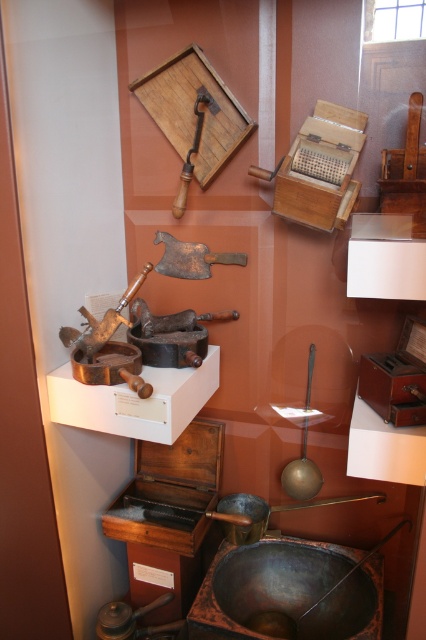
Question: Observing the image, what is the correct spatial positioning of brass/bronze axe at center in reference to wooden handle at upper center?

Choices:
 (A) right
 (B) left

Answer: (A)

Question: Can you confirm if brass/bronze axe at center is positioned below matte silver hammer at center-left?

Choices:
 (A) no
 (B) yes

Answer: (A)

Question: Among these points, which one is farthest from the camera?

Choices:
 (A) (207, 92)
 (B) (216, 252)
 (C) (92, 342)

Answer: (B)

Question: Considering the relative positions of matte silver hammer at center-left and wooden handle at upper center in the image provided, where is matte silver hammer at center-left located with respect to wooden handle at upper center?

Choices:
 (A) right
 (B) left

Answer: (B)

Question: Which point appears closest to the camera in this image?

Choices:
 (A) (192, 140)
 (B) (207, 253)
 (C) (100, 339)

Answer: (C)

Question: Which object is the closest to the wooden handle at upper center?

Choices:
 (A) matte silver hammer at center-left
 (B) brass/bronze axe at center

Answer: (B)